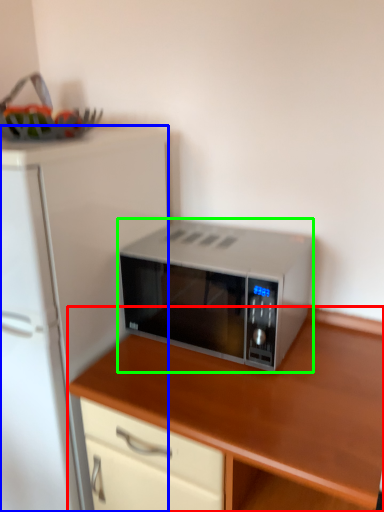
Question: Which object is positioned closest to cabinetry (highlighted by a red box)? Select from refrigerator (highlighted by a blue box) and microwave oven (highlighted by a green box).

Choices:
 (A) refrigerator
 (B) microwave oven

Answer: (B)